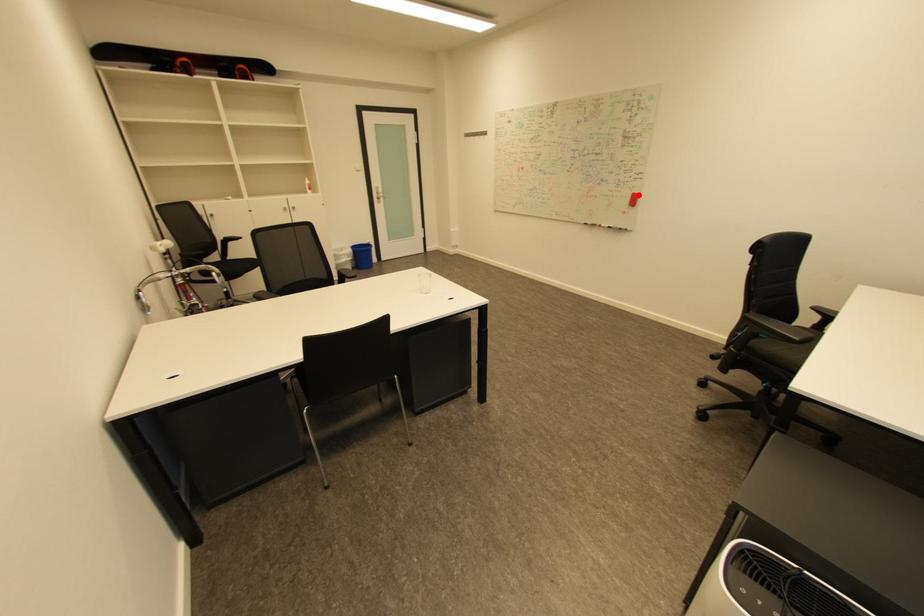
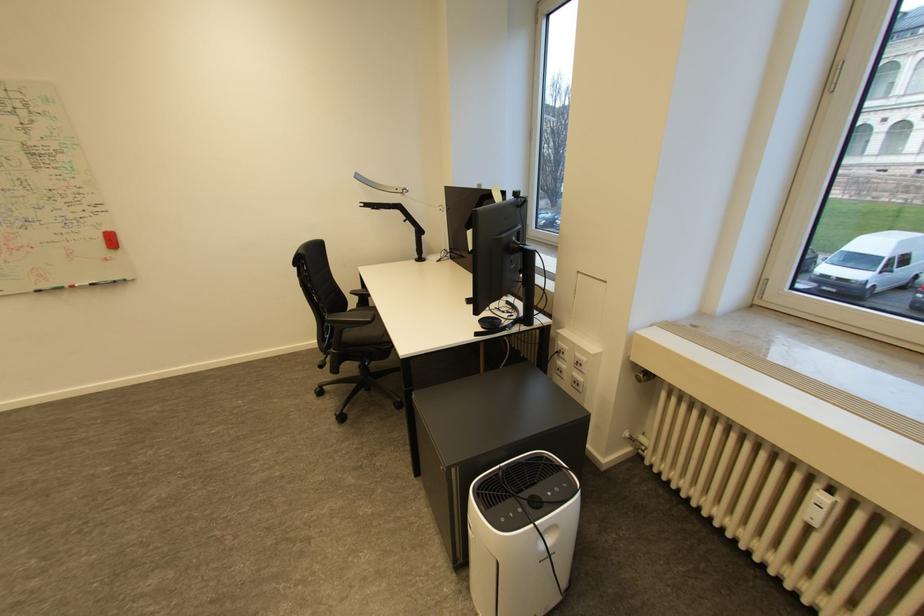
In the second image, find the point that corresponds to the highlighted location in the first image.

(108, 235)